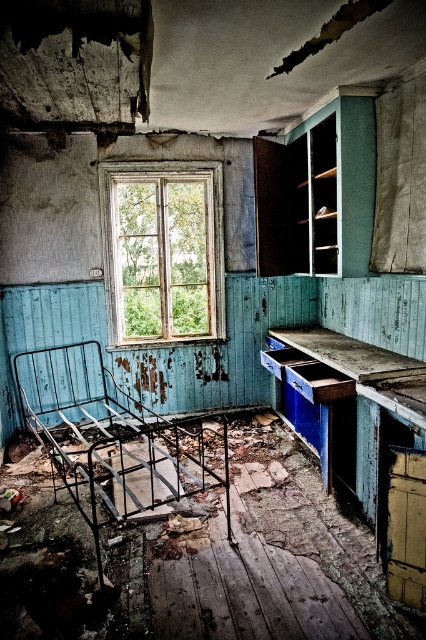
Who is shorter, rusty metal bed at lower left or wooden window at center?

Standing shorter between the two is rusty metal bed at lower left.

Does rusty metal bed at lower left have a lesser width compared to wooden window at center?

Incorrect, rusty metal bed at lower left's width is not less than wooden window at center's.

The width and height of the screenshot is (426, 640). What do you see at coordinates (112, 438) in the screenshot? I see `rusty metal bed at lower left` at bounding box center [112, 438].

Find the location of a particular element. rusty metal bed at lower left is located at coordinates point(112,438).